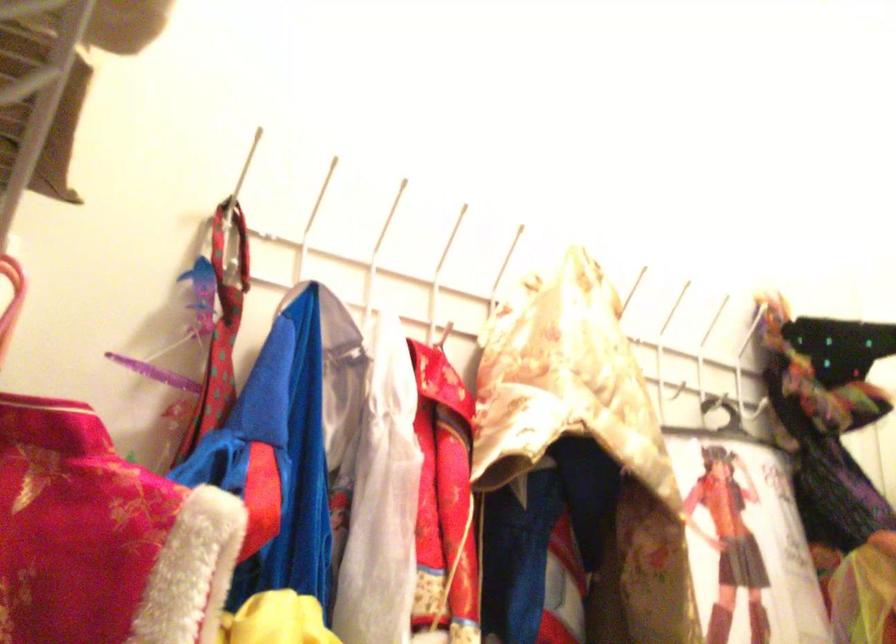
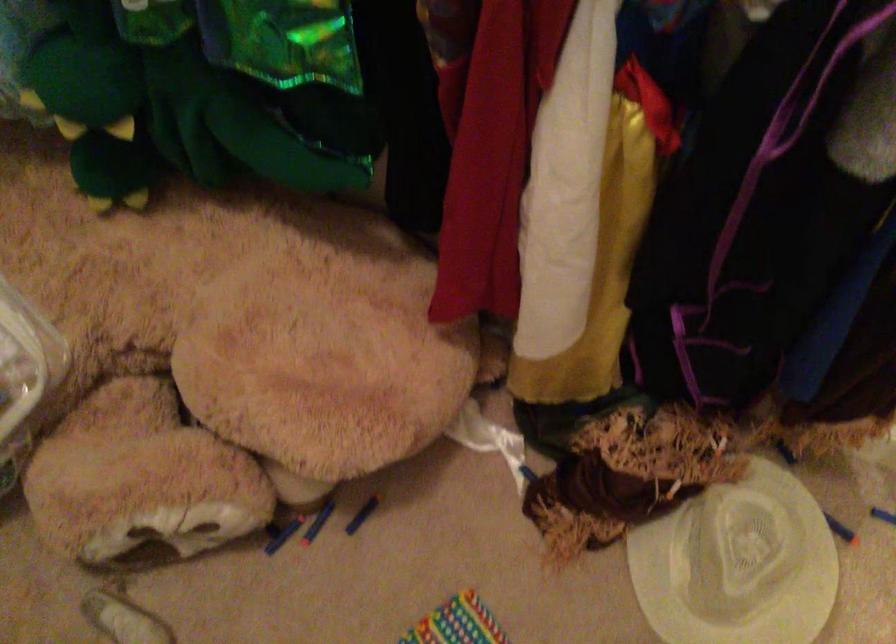
First-person continuous shooting, in which direction is the camera rotating?

The rotation direction of the camera is left-down.